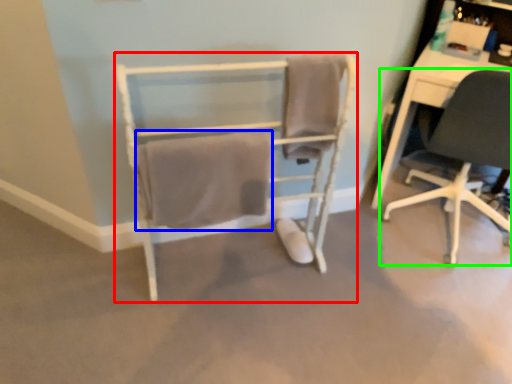
Question: Based on their relative distances, which object is nearer to chair (highlighted by a red box)? Choose from bath towel (highlighted by a blue box) and chair (highlighted by a green box).

Choices:
 (A) bath towel
 (B) chair

Answer: (A)